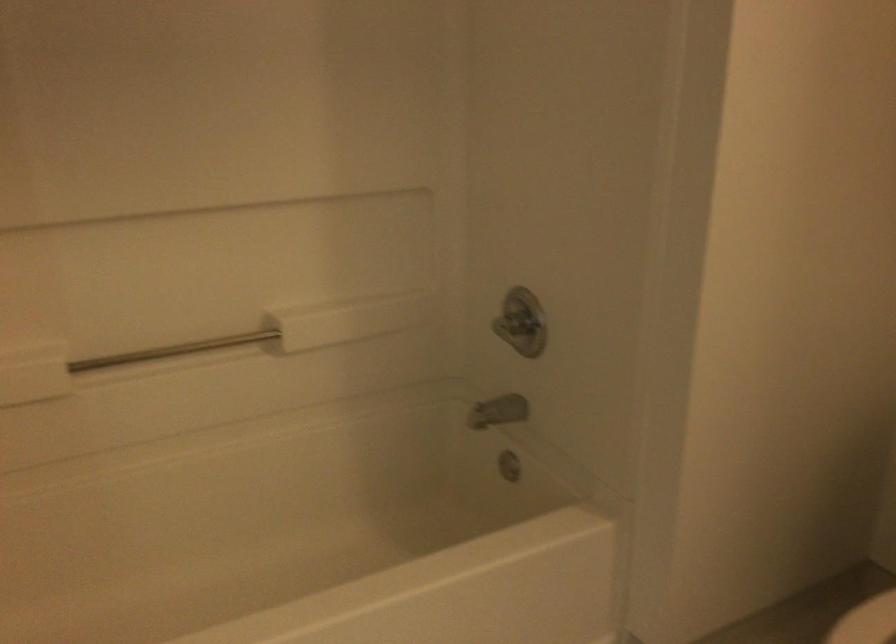
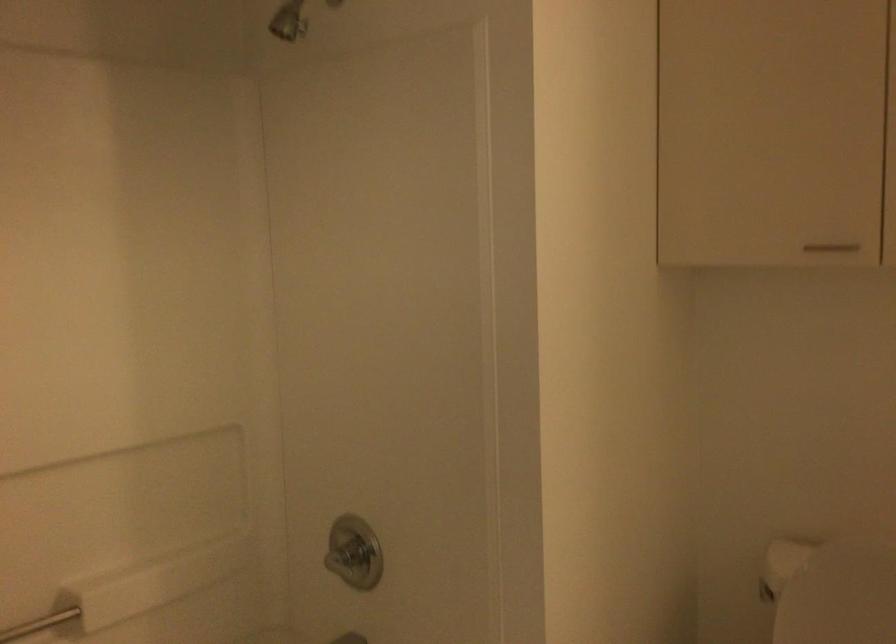
Question: The images are taken continuously from a first-person perspective. In which direction is your viewpoint rotating?

Choices:
 (A) Left
 (B) Right
 (C) Up
 (D) Down

Answer: (B)